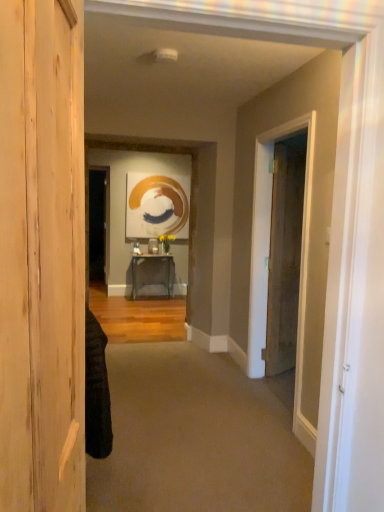
Question: From the image's perspective, would you say carpet at center is shown under brown wood door at right, which appears as the first door when viewed from the right?

Choices:
 (A) no
 (B) yes

Answer: (B)

Question: Considering the relative positions of carpet at center and brown wood door at right, the 1th door positioned from the back, in the image provided, is carpet at center in front of brown wood door at right, the 1th door positioned from the back,?

Choices:
 (A) yes
 (B) no

Answer: (A)

Question: Is brown wood door at right, the second door in the front-to-back sequence, at the back of carpet at center?

Choices:
 (A) no
 (B) yes

Answer: (A)

Question: From a real-world perspective, is carpet at center under brown wood door at right, the 1th door positioned from the back?

Choices:
 (A) yes
 (B) no

Answer: (A)

Question: Considering the relative sizes of carpet at center and brown wood door at right, the 1th door positioned from the back, in the image provided, is carpet at center thinner than brown wood door at right, the 1th door positioned from the back,?

Choices:
 (A) yes
 (B) no

Answer: (B)

Question: From a real-world perspective, is carpet at center positioned above or below metallic gray table at center?

Choices:
 (A) below
 (B) above

Answer: (A)

Question: In terms of height, does carpet at center look taller or shorter compared to metallic gray table at center?

Choices:
 (A) tall
 (B) short

Answer: (B)

Question: Would you say carpet at center is inside or outside metallic gray table at center?

Choices:
 (A) inside
 (B) outside

Answer: (B)

Question: From the image's perspective, relative to metallic gray table at center, is carpet at center above or below?

Choices:
 (A) above
 (B) below

Answer: (B)

Question: Considering their positions, is brown wood door at right, placed as the 2th door when sorted from left to right, located in front of or behind metallic gray table at center?

Choices:
 (A) behind
 (B) front

Answer: (B)

Question: From a real-world perspective, is brown wood door at right, placed as the 2th door when sorted from left to right, positioned above or below metallic gray table at center?

Choices:
 (A) below
 (B) above

Answer: (B)

Question: Considering the positions of brown wood door at right, the 1th door positioned from the back, and metallic gray table at center in the image, is brown wood door at right, the 1th door positioned from the back, bigger or smaller than metallic gray table at center?

Choices:
 (A) big
 (B) small

Answer: (B)

Question: Is brown wood door at right, placed as the 2th door when sorted from left to right, taller or shorter than metallic gray table at center?

Choices:
 (A) tall
 (B) short

Answer: (A)

Question: In terms of width, does metallic gray table at center look wider or thinner when compared to carpet at center?

Choices:
 (A) thin
 (B) wide

Answer: (A)

Question: In the image, is metallic gray table at center positioned in front of or behind carpet at center?

Choices:
 (A) front
 (B) behind

Answer: (B)